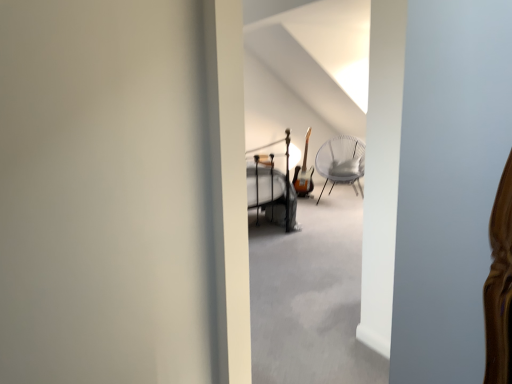
Question: From the image's perspective, relative to metallic silver bunk bed at center, is white wicker chair at center above or below?

Choices:
 (A) above
 (B) below

Answer: (A)

Question: Relative to metallic silver bunk bed at center, is white wicker chair at center in front or behind?

Choices:
 (A) front
 (B) behind

Answer: (B)

Question: Is white wicker chair at center spatially inside metallic silver bunk bed at center, or outside of it?

Choices:
 (A) inside
 (B) outside

Answer: (B)

Question: From a real-world perspective, relative to white wicker chair at center, is metallic silver bunk bed at center vertically above or below?

Choices:
 (A) below
 (B) above

Answer: (B)

Question: Looking at the image, does metallic silver bunk bed at center seem bigger or smaller compared to white wicker chair at center?

Choices:
 (A) small
 (B) big

Answer: (B)

Question: Considering the positions of point (280, 218) and point (350, 155), is point (280, 218) closer or farther from the camera than point (350, 155)?

Choices:
 (A) farther
 (B) closer

Answer: (B)

Question: From the image's perspective, is metallic silver bunk bed at center located above or below white wicker chair at center?

Choices:
 (A) above
 (B) below

Answer: (B)